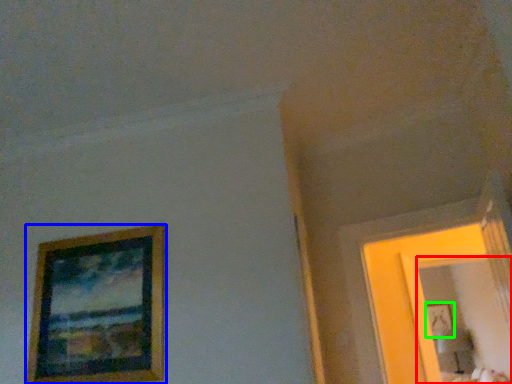
Question: Based on their relative distances, which object is farther from mirror (highlighted by a red box)? Choose from picture frame (highlighted by a blue box) and picture frame (highlighted by a green box).

Choices:
 (A) picture frame
 (B) picture frame

Answer: (A)